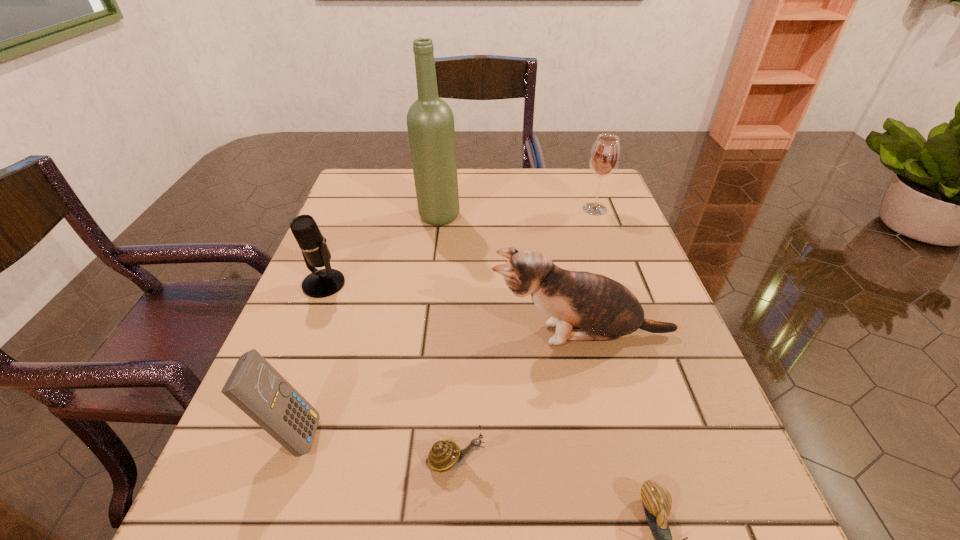
This screenshot has width=960, height=540. What are the coordinates of `free space between the cat and the taller escargot` in the screenshot? It's located at (518, 398).

In order to click on vacant area that lies between the microphone and the calculator in this screenshot , I will do `click(307, 359)`.

Find the location of a particular element. The height and width of the screenshot is (540, 960). vacant area that lies between the fourth nearest object and the second shortest object is located at coordinates (518, 398).

The width and height of the screenshot is (960, 540). In order to click on unoccupied position between the microphone and the wineglass in this screenshot , I will do `click(459, 247)`.

Choose which object is the third nearest neighbor to the calculator. Please provide its 2D coordinates. Your answer should be formatted as a tuple, i.e. [(x, y)], where the tuple contains the x and y coordinates of a point satisfying the conditions above.

[(605, 309)]

Locate an element on the screen. object that is the third closest to the fourth farthest object is located at coordinates (255, 386).

Find the location of `vacant region that satisfies the following two spatial constraints: 1. on the back side of the microphone; 2. on the right side of the wineglass`. vacant region that satisfies the following two spatial constraints: 1. on the back side of the microphone; 2. on the right side of the wineglass is located at coordinates point(353,209).